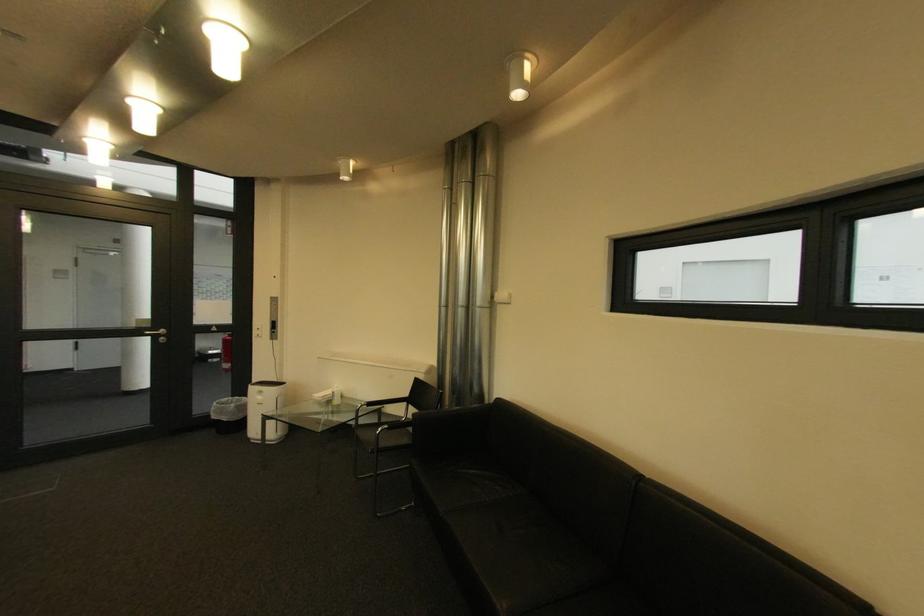
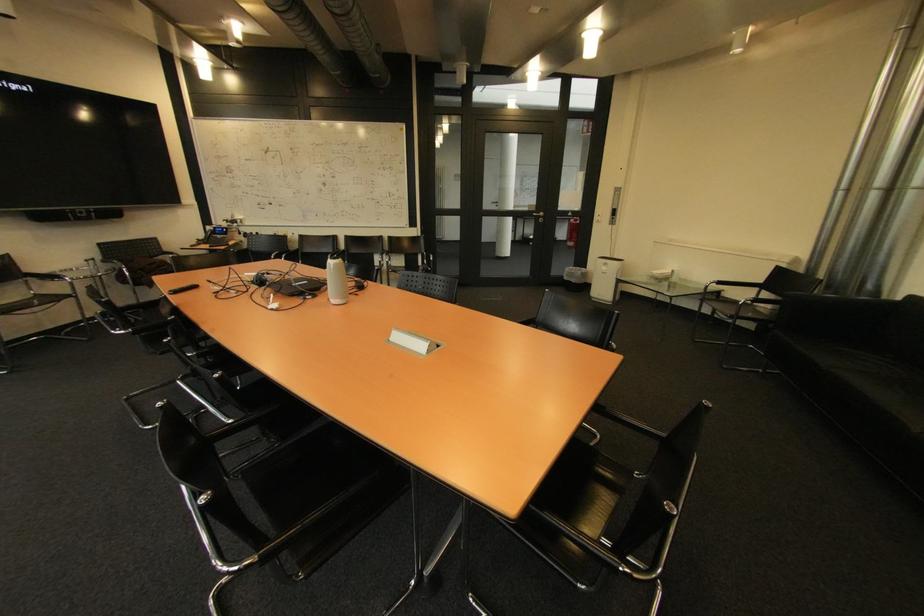
The point at (268, 399) is marked in the first image. Where is the corresponding point in the second image?

(613, 270)